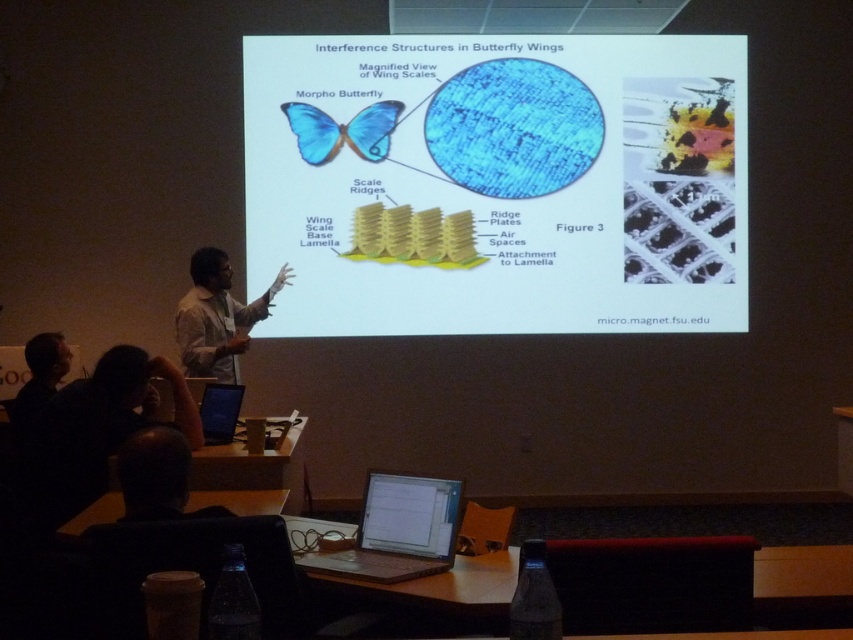
Question: Is satin silver laptop at lower center bigger than white shirt at center?

Choices:
 (A) no
 (B) yes

Answer: (A)

Question: Does blue glossy butterfly wing at center have a smaller size compared to white glossy screen at center?

Choices:
 (A) yes
 (B) no

Answer: (B)

Question: Considering the real-world distances, which object is farthest from the white shirt at center?

Choices:
 (A) satin silver laptop at lower center
 (B) white glossy screen at center
 (C) dark hair at lower left

Answer: (A)

Question: Which point appears farthest from the camera in this image?

Choices:
 (A) (178, 307)
 (B) (328, 556)
 (C) (305, 113)
 (D) (51, 364)

Answer: (C)

Question: In this image, where is blue glossy butterfly wing at center located relative to blue matte laptop at lower left?

Choices:
 (A) left
 (B) right

Answer: (B)

Question: Among these points, which one is nearest to the camera?

Choices:
 (A) (422, 550)
 (B) (432, 502)

Answer: (A)